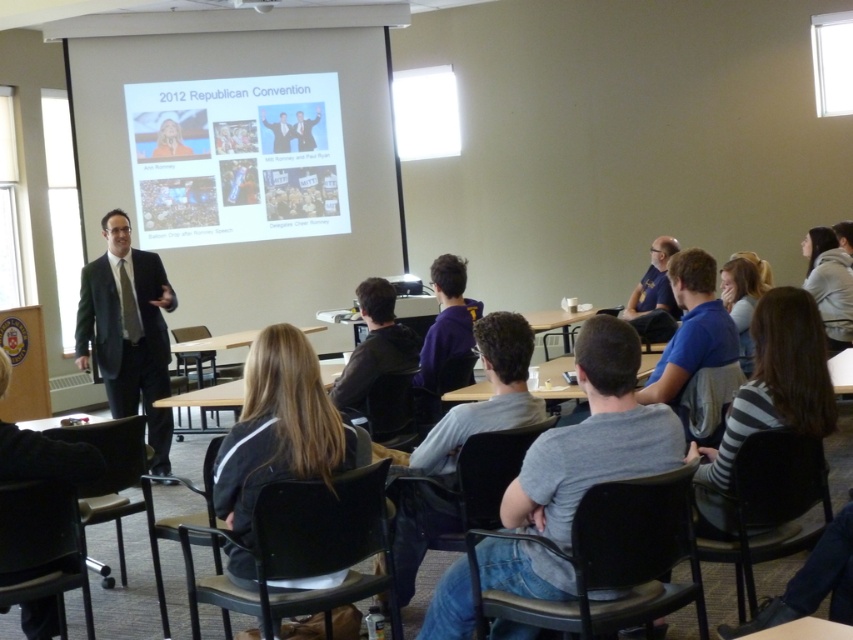
Question: Is gray cotton shirt at center closer to the viewer compared to blue fabric shirt at center?

Choices:
 (A) yes
 (B) no

Answer: (A)

Question: Which point is closer to the camera?

Choices:
 (A) dark gray suit at left
 (B) dark gray hoodie at center
 (C) white matte projector screen at upper center

Answer: (B)

Question: Which object is closer to the camera taking this photo?

Choices:
 (A) blue fabric shirt at center
 (B) gray cotton shirt at center

Answer: (B)

Question: Estimate the real-world distances between objects in this image. Which object is farther from the dark gray hoodie at center?

Choices:
 (A) black plastic projector at upper center
 (B) gray cotton shirt at center

Answer: (A)

Question: Is dark gray suit at left behind blue fabric shirt at center?

Choices:
 (A) yes
 (B) no

Answer: (B)

Question: Does dark gray hoodie at center come behind blue fabric shirt at center?

Choices:
 (A) no
 (B) yes

Answer: (A)